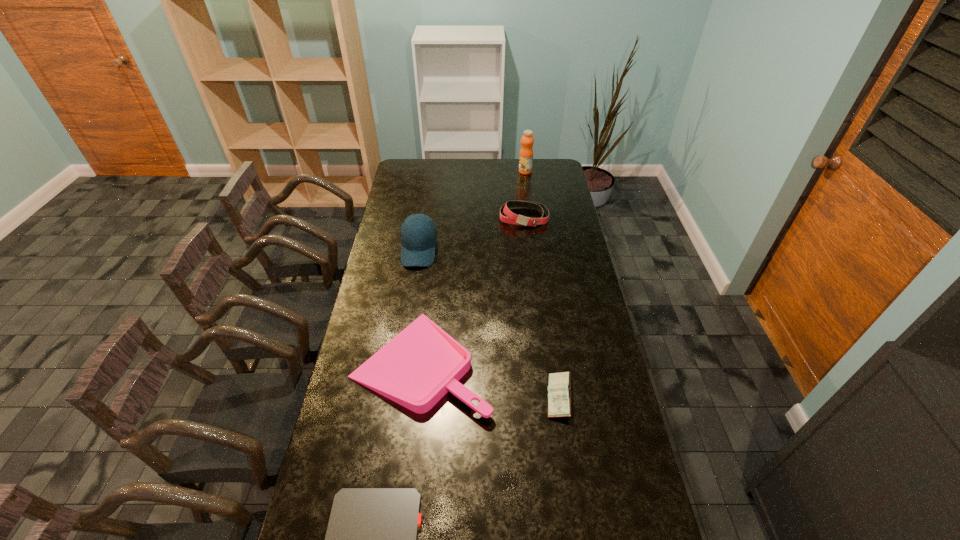
The width and height of the screenshot is (960, 540). Find the location of `the farthest object`. the farthest object is located at coordinates (526, 152).

At what (x,y) coordinates should I click in order to perform the action: click on the tallest object. Please return your answer as a coordinate pair (x, y). Looking at the image, I should click on (526, 152).

I want to click on the third farthest object, so click(x=418, y=232).

Locate an element on the screen. Image resolution: width=960 pixels, height=540 pixels. the fifth shortest object is located at coordinates (418, 232).

Where is `the second farthest object`? This screenshot has width=960, height=540. the second farthest object is located at coordinates (512, 218).

The width and height of the screenshot is (960, 540). Identify the location of the third tallest object. coord(512,218).

The height and width of the screenshot is (540, 960). In order to click on dustpan in this screenshot , I will do `click(415, 369)`.

I want to click on diary, so click(559, 388).

Find the location of a particular element. Image resolution: width=960 pixels, height=540 pixels. free space located on the right of the tallest object is located at coordinates (550, 171).

Identify the location of vacant space located 0.300m on the front-facing side of the fifth shortest object. (408, 323).